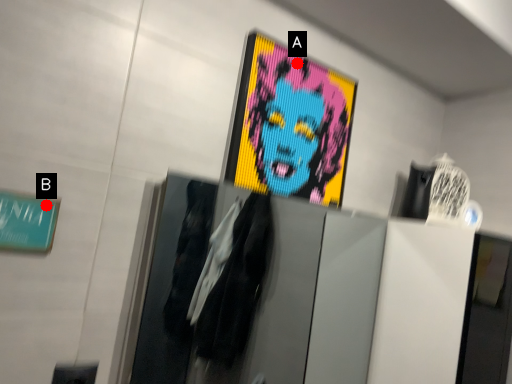
Question: Two points are circled on the image, labeled by A and B beside each circle. Which point is closer to the camera taking this photo?

Choices:
 (A) A is closer
 (B) B is closer

Answer: (B)